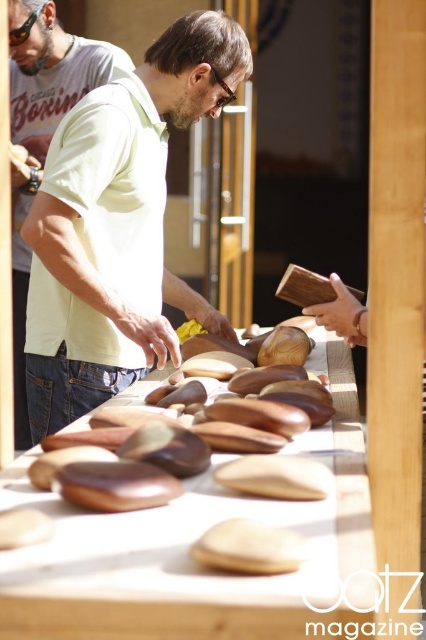
You are a customer at the market and want to place an item on the wooden table at center. However, there is a person wearing a matte yellow shirt at center standing in front of the table. Can you place the item directly on the table without moving the person?

The wooden table at center is in front of the matte yellow shirt at center, meaning the table is closer to you than the person. Since the table is in front, you can place the item directly on the wooden table at center without needing to move the person.

You are a customer at the market and want to pick up an item from the wooden table at center. Considering the height of the matte yellow shirt at center you are wearing, will you need to bend down to reach the table?

The wooden table at center is not as tall as the matte yellow shirt at center, meaning the table is shorter than the shirt. Since the shirt is part of your height, you would need to bend down to reach the wooden table at center.